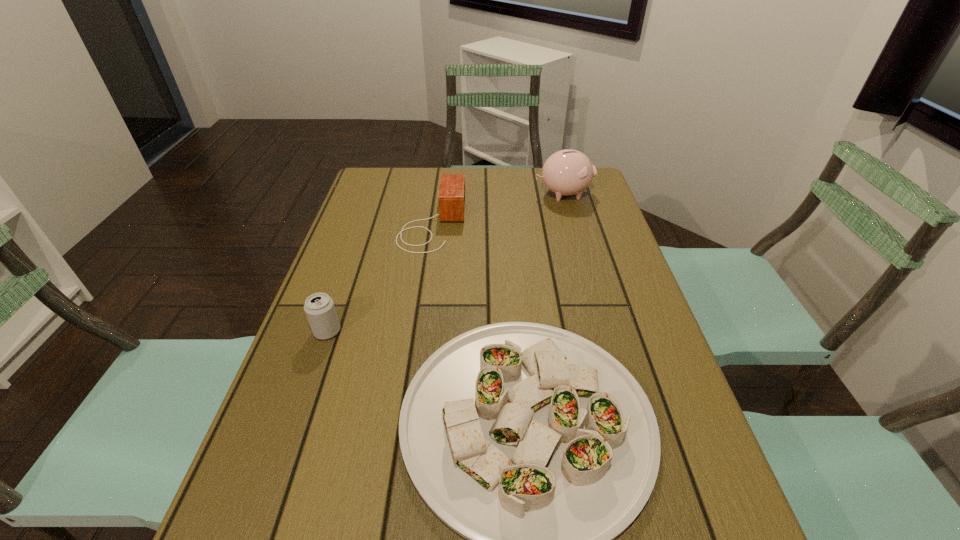
The width and height of the screenshot is (960, 540). In order to click on free space between the can and the piggy bank in this screenshot , I will do `click(445, 262)`.

I want to click on empty space between the radio receiver and the tallest object, so click(x=497, y=208).

Where is `free space between the piggy bank and the radio receiver`? This screenshot has width=960, height=540. free space between the piggy bank and the radio receiver is located at coordinates (497, 208).

At what (x,y) coordinates should I click in order to perform the action: click on vacant area that lies between the piggy bank and the radio receiver. Please return your answer as a coordinate pair (x, y). The height and width of the screenshot is (540, 960). Looking at the image, I should click on (497, 208).

Point out which object is positioned as the third nearest to the shortest object. Please provide its 2D coordinates. Your answer should be formatted as a tuple, i.e. [(x, y)], where the tuple contains the x and y coordinates of a point satisfying the conditions above.

[(567, 172)]

Identify which object is located as the second nearest to the tallest object. Please provide its 2D coordinates. Your answer should be formatted as a tuple, i.e. [(x, y)], where the tuple contains the x and y coordinates of a point satisfying the conditions above.

[(536, 445)]